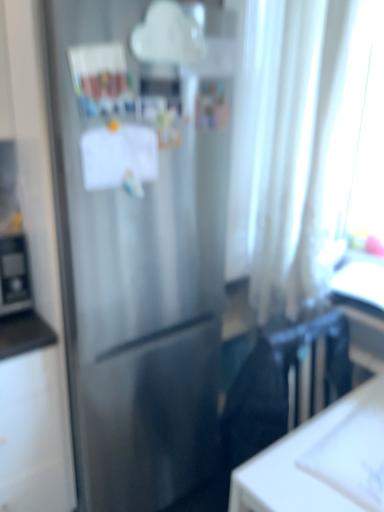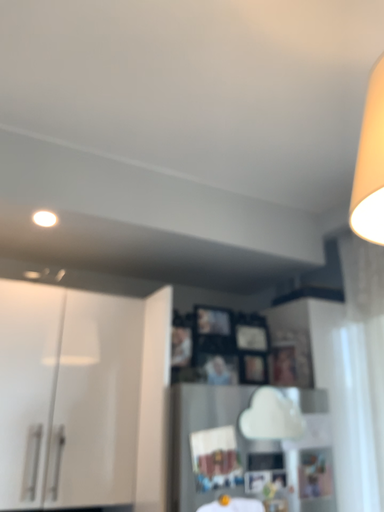
Question: How did the camera likely rotate when shooting the video?

Choices:
 (A) rotated right
 (B) rotated left

Answer: (B)